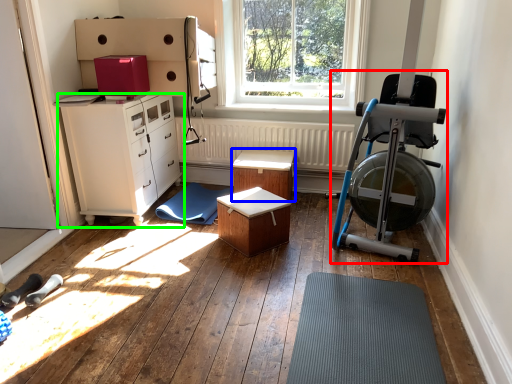
Question: Which object is the closest to the baby carriage (highlighted by a red box)? Choose among these: table (highlighted by a blue box) or chest of drawers (highlighted by a green box).

Choices:
 (A) table
 (B) chest of drawers

Answer: (A)